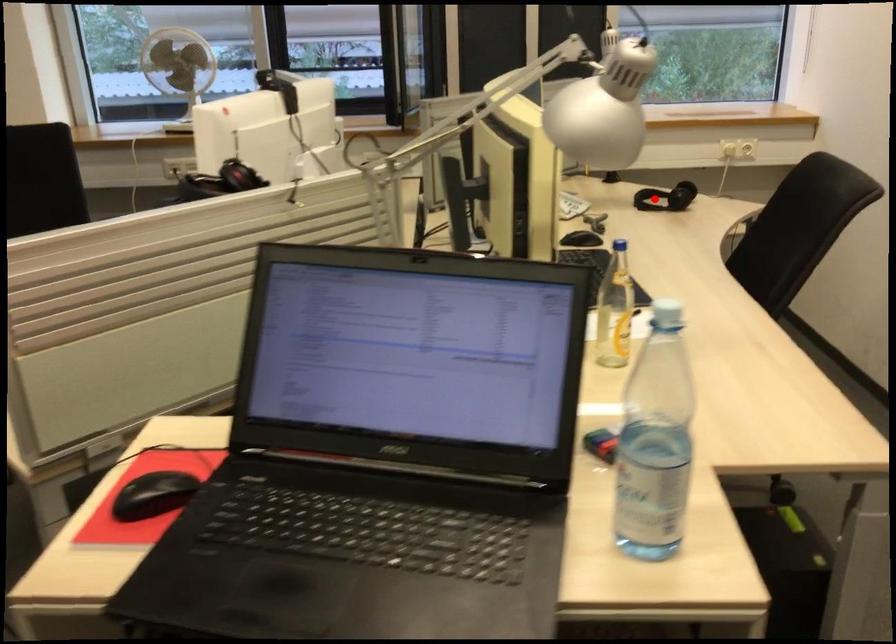
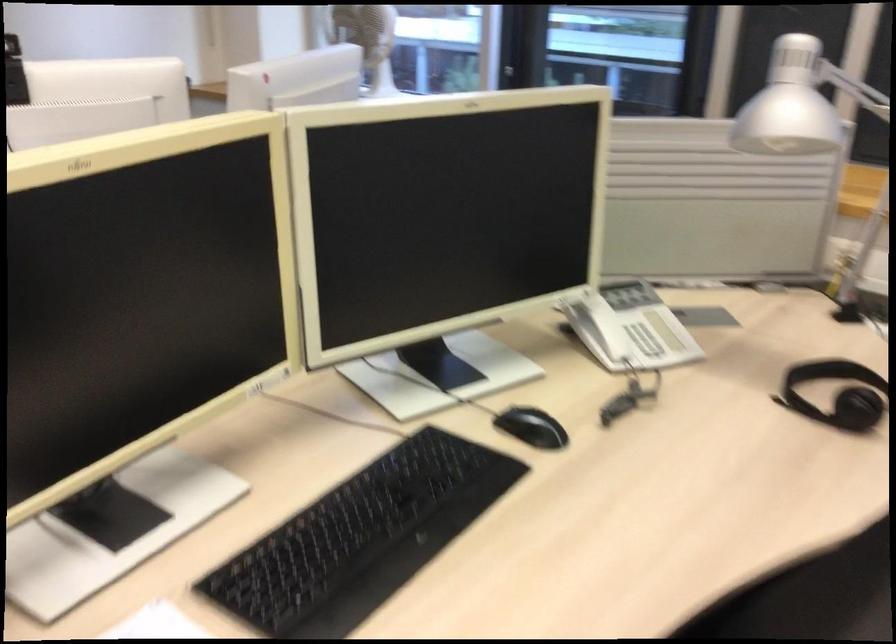
Question: I am providing you with two images of the same scene from different viewpoints. A red point is shown in image1. For the corresponding object point in image2, is it positioned nearer or farther from the camera?

Choices:
 (A) Nearer
 (B) Farther

Answer: (A)